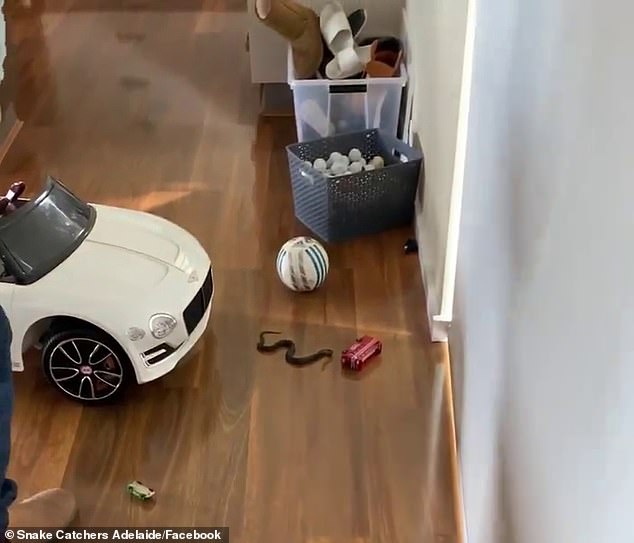
This screenshot has height=543, width=634. Find the location of `wall`. wall is located at coordinates (557, 430).